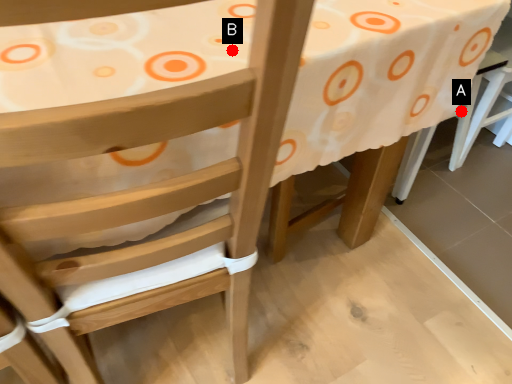
Question: Two points are circled on the image, labeled by A and B beside each circle. Which point is farther from the camera taking this photo?

Choices:
 (A) A is further
 (B) B is further

Answer: (A)